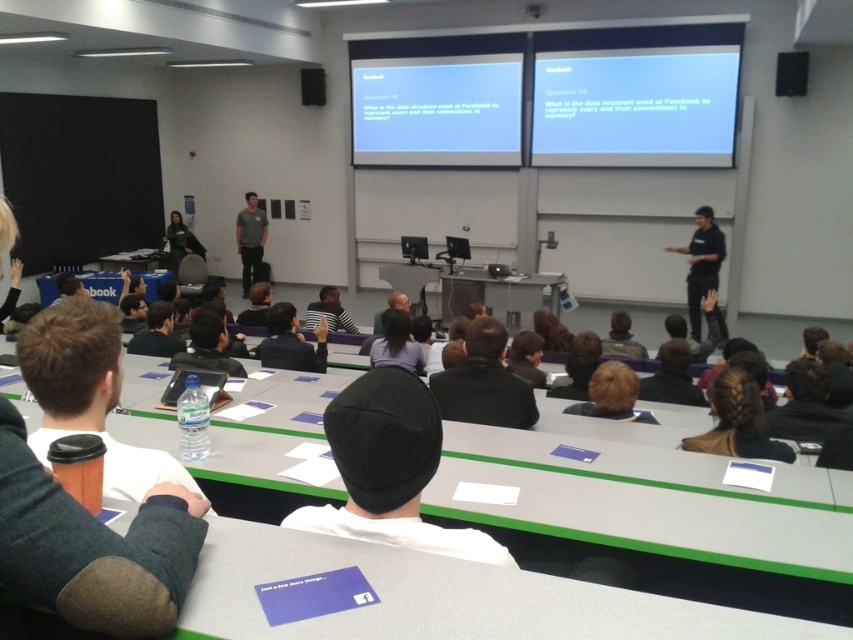
You are organizing a classroom cleanup. You have a storage box that can only accommodate items shorter than the black leather jacket at center. Can the brown paper cup at lower left be placed inside the box?

The brown paper cup at lower left is shorter than the black leather jacket at center, so yes, it can be placed inside the storage box.

You are a student in the classroom and need to present your slides. The projector is placed 1.5 meters away from the white matte projection screen at upper center. Can you adjust the projector to also project onto the white matte projector screen at upper center without moving the projector?

The distance between the white matte projection screen at upper center and the white matte projector screen at upper center is 1.24 meters. Since the projector is already 1.5 meters away from the first screen, adjusting the projector to reach the second screen may be possible if the projector has sufficient zoom or lens adjustment capabilities to cover both screens within that distance range.